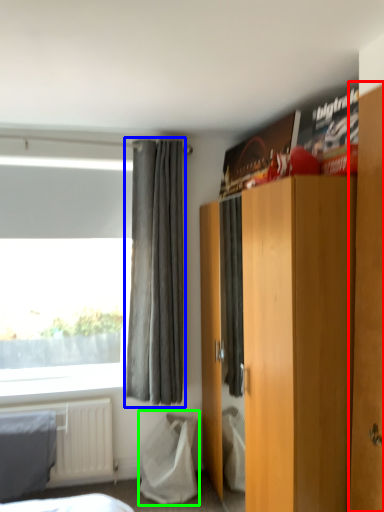
Question: Which object is the farthest from armoire (highlighted by a red box)? Choose among these: curtain (highlighted by a blue box) or sheet (highlighted by a green box).

Choices:
 (A) curtain
 (B) sheet

Answer: (B)